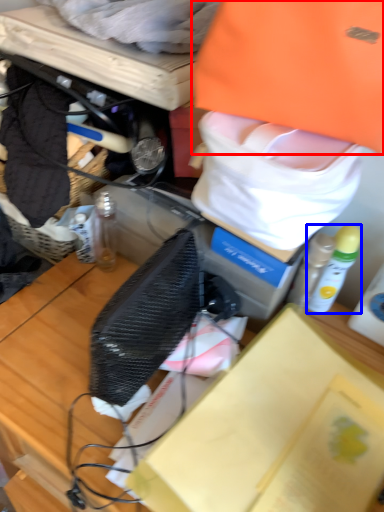
Question: Which of the following is the closest to the observer, clothing (highlighted by a red box) or bottle (highlighted by a blue box)?

Choices:
 (A) clothing
 (B) bottle

Answer: (A)